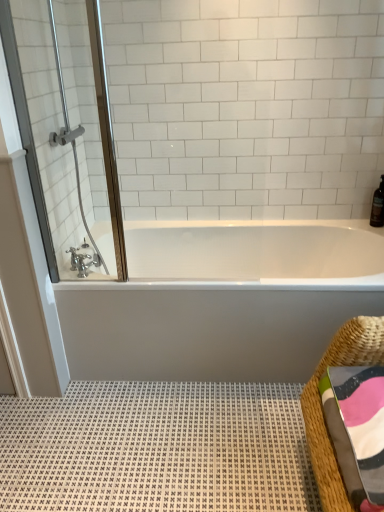
Describe the element at coordinates (157, 449) in the screenshot. I see `white textured bath mat at lower center` at that location.

What do you see at coordinates (66, 129) in the screenshot? I see `clear glass shower door at upper left` at bounding box center [66, 129].

Find the location of a particular element. The height and width of the screenshot is (512, 384). clear glass shower door at upper left is located at coordinates (66, 129).

Measure the distance between multicolored woven towel at lower right and camera.

multicolored woven towel at lower right and camera are 1.13 meters apart from each other.

Describe the element at coordinates (357, 429) in the screenshot. I see `multicolored woven towel at lower right` at that location.

Identify the location of white glossy bathtub at center. (223, 301).

Identify the location of white textured bath mat at lower center. Image resolution: width=384 pixels, height=512 pixels. (157, 449).

Looking at this image, from the image's perspective, does clear glass shower door at upper left appear higher than brown glass bottle at upper right?

Yes, from the image's perspective, clear glass shower door at upper left is over brown glass bottle at upper right.

Based on the photo, from a real-world perspective, which is physically above, clear glass shower door at upper left or brown glass bottle at upper right?

In real-world perspective, clear glass shower door at upper left is above.

How distant is clear glass shower door at upper left from brown glass bottle at upper right?

They are 1.76 meters apart.

Considering the sizes of objects clear glass shower door at upper left and brown glass bottle at upper right in the image provided, who is shorter, clear glass shower door at upper left or brown glass bottle at upper right?

Standing shorter between the two is brown glass bottle at upper right.

Is the depth of white glossy bathtub at center greater than that of white textured bath mat at lower center?

Yes, it is.

Based on the photo, what's the angular difference between white glossy bathtub at center and white textured bath mat at lower center's facing directions?

There is a 90-degree angle between the facing directions of white glossy bathtub at center and white textured bath mat at lower center.

From the picture: Considering the sizes of white glossy bathtub at center and white textured bath mat at lower center in the image, is white glossy bathtub at center wider or thinner than white textured bath mat at lower center?

Considering their sizes, white glossy bathtub at center looks slimmer than white textured bath mat at lower center.

Is woven straw basket at lower right wider or thinner than brushed metal faucet at lower left?

In the image, woven straw basket at lower right appears to be wider than brushed metal faucet at lower left.

Is point (375, 358) positioned before point (84, 268)?

That is True.

Based on the photo, from a real-world perspective, is woven straw basket at lower right on brushed metal faucet at lower left?

No, from a real-world perspective, woven straw basket at lower right is not on top of brushed metal faucet at lower left.

From the image's perspective, would you say woven straw basket at lower right is positioned over brushed metal faucet at lower left?

No, from the image's perspective, woven straw basket at lower right is not above brushed metal faucet at lower left.

Is woven straw basket at lower right looking in the opposite direction of white textured bath mat at lower center?

woven straw basket at lower right is not turned away from white textured bath mat at lower center.

Considering the positions of point (377, 355) and point (0, 500), is point (377, 355) closer or farther from the camera than point (0, 500)?

Clearly, point (377, 355) is closer to the camera than point (0, 500).

Does woven straw basket at lower right lie in front of white textured bath mat at lower center?

Yes, it is in front of white textured bath mat at lower center.

Between woven straw basket at lower right and multicolored woven towel at lower right, which one appears on the left side from the viewer's perspective?

From the viewer's perspective, multicolored woven towel at lower right appears more on the left side.

Is multicolored woven towel at lower right inside woven straw basket at lower right?

Yes, woven straw basket at lower right contains multicolored woven towel at lower right.

From the image's perspective, between woven straw basket at lower right and multicolored woven towel at lower right, who is located below?

woven straw basket at lower right appears lower in the image.

Considering the sizes of objects woven straw basket at lower right and multicolored woven towel at lower right in the image provided, who is shorter, woven straw basket at lower right or multicolored woven towel at lower right?

Standing shorter between the two is multicolored woven towel at lower right.

From the picture: Is white textured bath mat at lower center far away from multicolored woven towel at lower right?

Actually, white textured bath mat at lower center and multicolored woven towel at lower right are a little close together.

Which of these two, white textured bath mat at lower center or multicolored woven towel at lower right, is bigger?

white textured bath mat at lower center is bigger.

You are a GUI agent. You are given a task and a screenshot of the screen. Output one action in this format:
    pyautogui.click(x=<x>, y=<y>)
    Task: Click on the bath mat located on the left of multicolored woven towel at lower right
    
    Given the screenshot: What is the action you would take?
    pyautogui.click(x=157, y=449)

Considering the points (93, 263) and (257, 478), which point is behind, point (93, 263) or point (257, 478)?

The point (93, 263) is farther.

Considering the relative sizes of brushed metal faucet at lower left and white textured bath mat at lower center in the image provided, is brushed metal faucet at lower left taller than white textured bath mat at lower center?

Indeed, brushed metal faucet at lower left has a greater height compared to white textured bath mat at lower center.

Considering the relative positions of brushed metal faucet at lower left and white textured bath mat at lower center in the image provided, is brushed metal faucet at lower left to the right of white textured bath mat at lower center from the viewer's perspective?

In fact, brushed metal faucet at lower left is to the left of white textured bath mat at lower center.

Is brushed metal faucet at lower left facing towards white textured bath mat at lower center?

No, brushed metal faucet at lower left is not facing towards white textured bath mat at lower center.

This screenshot has width=384, height=512. In order to click on screen door to the left of brown glass bottle at upper right in this screenshot , I will do `click(66, 129)`.

What are the coordinates of `bath mat that is under the white glossy bathtub at center (from a real-world perspective)` in the screenshot? It's located at (157, 449).

Looking at the image, which one is located further to woven straw basket at lower right, brown glass bottle at upper right or white glossy bathtub at center?

brown glass bottle at upper right.

Estimate the real-world distances between objects in this image. Which object is further from white glossy bathtub at center, white textured bath mat at lower center or woven straw basket at lower right?

The object further to white glossy bathtub at center is woven straw basket at lower right.

Which object lies further to the anchor point white glossy bathtub at center, brown glass bottle at upper right or clear glass shower door at upper left?

Based on the image, brown glass bottle at upper right appears to be further to white glossy bathtub at center.

Considering their positions, is multicolored woven towel at lower right positioned closer to white glossy bathtub at center than clear glass shower door at upper left?

Based on the image, clear glass shower door at upper left appears to be nearer to white glossy bathtub at center.

Considering their positions, is white textured bath mat at lower center positioned closer to multicolored woven towel at lower right than woven straw basket at lower right?

woven straw basket at lower right lies closer to multicolored woven towel at lower right than the other object.

Which object lies nearer to the anchor point white glossy bathtub at center, brushed metal faucet at lower left or brown glass bottle at upper right?

Based on the image, brushed metal faucet at lower left appears to be nearer to white glossy bathtub at center.

Estimate the real-world distances between objects in this image. Which object is further from brushed metal faucet at lower left, clear glass shower door at upper left or woven straw basket at lower right?

Based on the image, woven straw basket at lower right appears to be further to brushed metal faucet at lower left.

Looking at the image, which one is located closer to white glossy bathtub at center, brushed metal faucet at lower left or clear glass shower door at upper left?

Among the two, brushed metal faucet at lower left is located nearer to white glossy bathtub at center.

I want to click on bath towel between clear glass shower door at upper left and brown glass bottle at upper right from left to right, so click(357, 429).

Locate an element on the screen. This screenshot has height=512, width=384. screen door between brushed metal faucet at lower left and white glossy bathtub at center from left to right is located at coordinates (66, 129).

Where is `basket between clear glass shower door at upper left and brown glass bottle at upper right from left to right`? basket between clear glass shower door at upper left and brown glass bottle at upper right from left to right is located at coordinates (321, 407).

Find the location of a particular element. This screenshot has height=512, width=384. bath mat between woven straw basket at lower right and brown glass bottle at upper right along the z-axis is located at coordinates (157, 449).